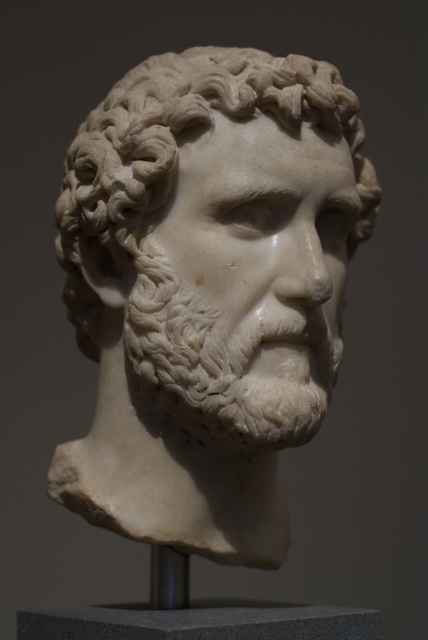
Question: Does white marble bust at center appear on the right side of gray granite pedestal at center?

Choices:
 (A) no
 (B) yes

Answer: (B)

Question: Does white marble bust at center appear over gray granite pedestal at center?

Choices:
 (A) yes
 (B) no

Answer: (A)

Question: Does white marble bust at center appear under gray granite pedestal at center?

Choices:
 (A) yes
 (B) no

Answer: (B)